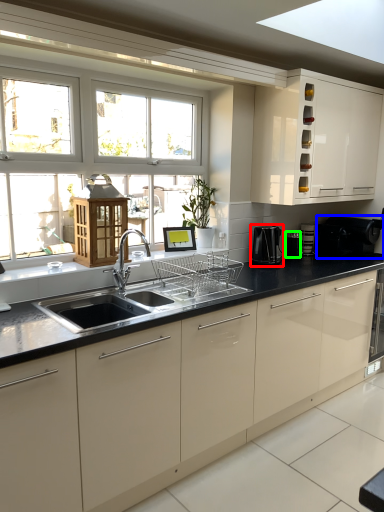
Question: Considering the real-world distances, which object is closest to coffee machine (highlighted by a red box)? appliance (highlighted by a blue box) or appliance (highlighted by a green box).

Choices:
 (A) appliance
 (B) appliance

Answer: (B)